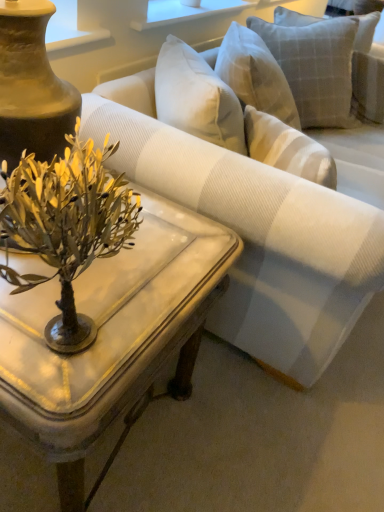
Question: Considering the relative positions of white striped fabric couch at center and white marble coffee table at center in the image provided, is white striped fabric couch at center in front of white marble coffee table at center?

Choices:
 (A) yes
 (B) no

Answer: (B)

Question: From the image's perspective, is white striped fabric couch at center on top of white marble coffee table at center?

Choices:
 (A) yes
 (B) no

Answer: (A)

Question: Is white striped fabric couch at center positioned behind white marble coffee table at center?

Choices:
 (A) yes
 (B) no

Answer: (A)

Question: Does white striped fabric couch at center turn towards white marble coffee table at center?

Choices:
 (A) yes
 (B) no

Answer: (B)

Question: Is there a large distance between white striped fabric couch at center and white marble coffee table at center?

Choices:
 (A) no
 (B) yes

Answer: (A)

Question: Choose the correct answer: Is light gray textured pillow at upper right inside white striped fabric couch at center or outside it?

Choices:
 (A) outside
 (B) inside

Answer: (B)

Question: In terms of width, does light gray textured pillow at upper right look wider or thinner when compared to white striped fabric couch at center?

Choices:
 (A) wide
 (B) thin

Answer: (B)

Question: Looking at the image, does light gray textured pillow at upper right seem bigger or smaller compared to white striped fabric couch at center?

Choices:
 (A) small
 (B) big

Answer: (A)

Question: From their relative heights in the image, would you say light gray textured pillow at upper right is taller or shorter than white striped fabric couch at center?

Choices:
 (A) tall
 (B) short

Answer: (B)

Question: Is light gray textured pillow at upper right taller or shorter than white marble coffee table at center?

Choices:
 (A) short
 (B) tall

Answer: (B)

Question: Is point (321, 39) positioned closer to the camera than point (69, 426)?

Choices:
 (A) farther
 (B) closer

Answer: (A)

Question: Looking at the image, does light gray textured pillow at upper right seem bigger or smaller compared to white marble coffee table at center?

Choices:
 (A) big
 (B) small

Answer: (B)

Question: From the image's perspective, relative to white marble coffee table at center, is light gray textured pillow at upper right above or below?

Choices:
 (A) below
 (B) above

Answer: (B)

Question: From their relative heights in the image, would you say metallic gold plant at center is taller or shorter than white marble coffee table at center?

Choices:
 (A) short
 (B) tall

Answer: (A)

Question: Do you think metallic gold plant at center is within white marble coffee table at center, or outside of it?

Choices:
 (A) inside
 (B) outside

Answer: (B)